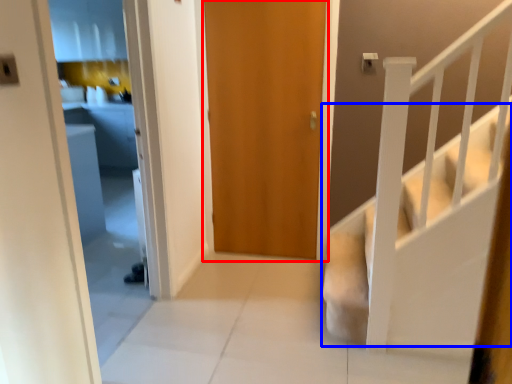
Question: Among these objects, which one is nearest to the camera, door (highlighted by a red box) or stairs (highlighted by a blue box)?

Choices:
 (A) door
 (B) stairs

Answer: (B)